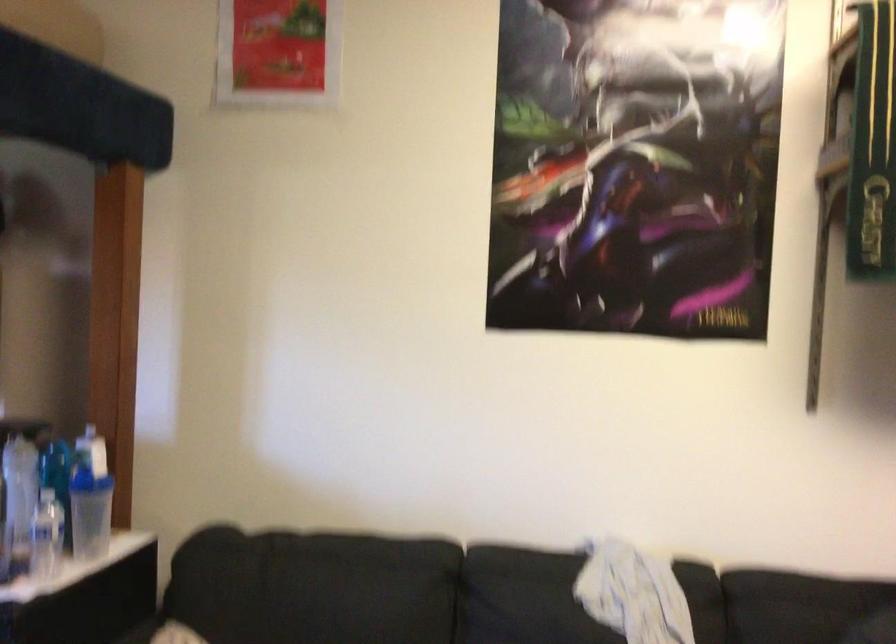
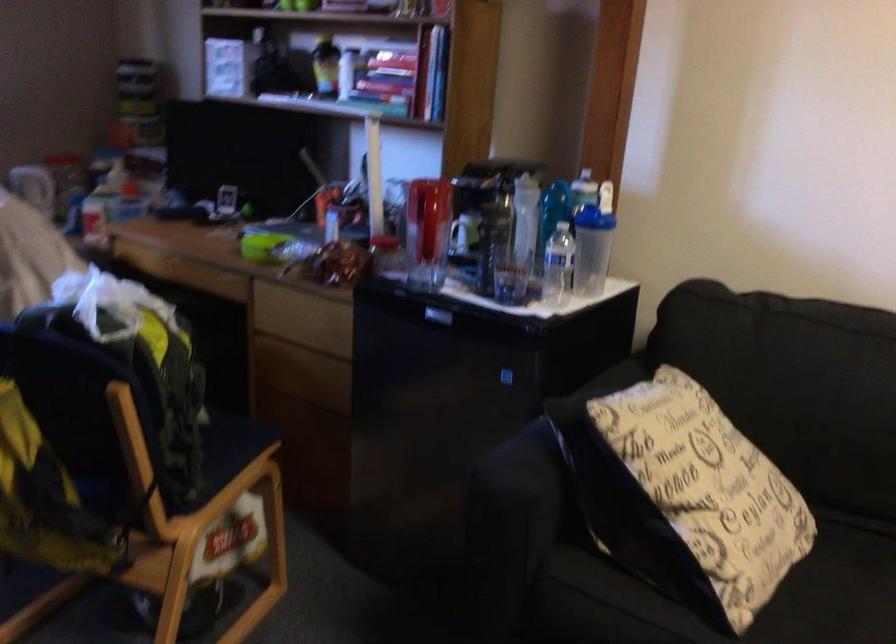
How did the camera likely rotate?

The camera's rotation is toward left-down.